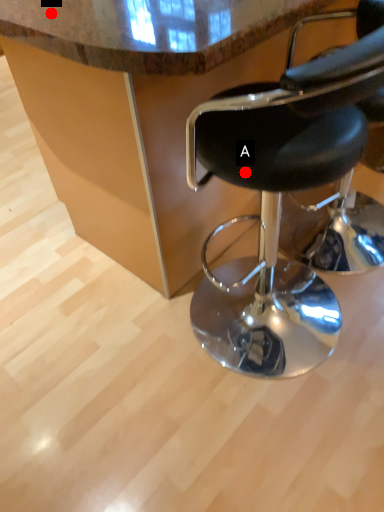
Question: Two points are circled on the image, labeled by A and B beside each circle. Which point is further to the camera?

Choices:
 (A) A is further
 (B) B is further

Answer: (B)